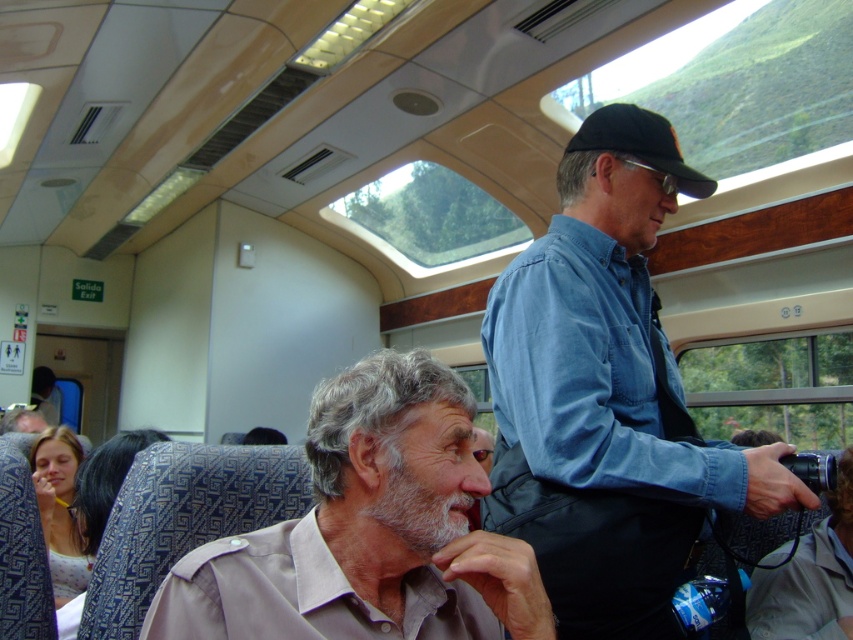
Is point (538, 536) closer to camera compared to point (416, 627)?

No, it is not.

Between blue denim shirt at upper center and gray fabric shirt at lower left, which one appears on the right side from the viewer's perspective?

blue denim shirt at upper center is more to the right.

Who is more forward, (558, 408) or (260, 592)?

Point (260, 592)

I want to click on blue denim shirt at upper center, so click(x=608, y=396).

Can you confirm if gray fabric shirt at lower left is positioned to the right of black fabric baseball cap at upper right?

Incorrect, gray fabric shirt at lower left is not on the right side of black fabric baseball cap at upper right.

Find the location of a particular element. The image size is (853, 640). gray fabric shirt at lower left is located at coordinates (368, 531).

You are a GUI agent. You are given a task and a screenshot of the screen. Output one action in this format:
    pyautogui.click(x=<x>, y=<y>)
    Task: Click on the gray fabric shirt at lower left
    The width and height of the screenshot is (853, 640).
    Given the screenshot: What is the action you would take?
    pyautogui.click(x=368, y=531)

The image size is (853, 640). What are the coordinates of `gray fabric shirt at lower left` in the screenshot? It's located at (368, 531).

Is blue denim shirt at upper center thinner than black fabric baseball cap at upper right?

No.

Which is more to the left, blue denim shirt at upper center or black fabric baseball cap at upper right?

blue denim shirt at upper center

In order to click on blue denim shirt at upper center in this screenshot , I will do `click(608, 396)`.